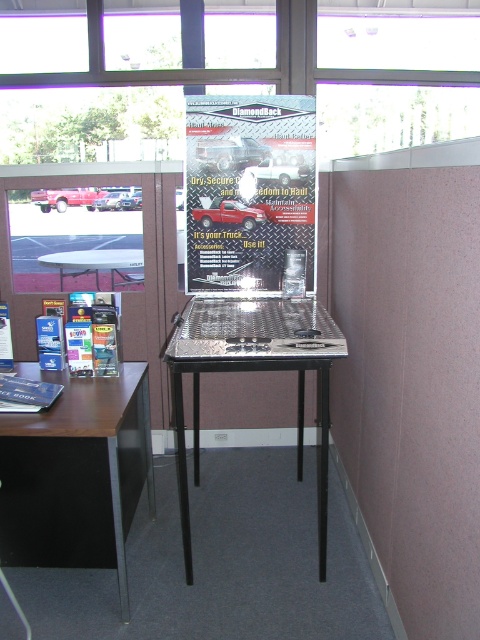
Question: Can you confirm if metallic/diamond plate table at center is positioned above transparent glass window at upper center?

Choices:
 (A) yes
 (B) no

Answer: (B)

Question: Which point appears closest to the camera in this image?

Choices:
 (A) (407, 124)
 (B) (332, 321)
 (C) (140, 417)

Answer: (B)

Question: Among these objects, which one is farthest from the camera?

Choices:
 (A) brown wood desk at lower left
 (B) transparent glass window at upper center

Answer: (B)

Question: Is diamond plate poster at center closer to the viewer compared to metallic/diamond plate table at center?

Choices:
 (A) no
 (B) yes

Answer: (A)

Question: Does matte black table at left have a greater width compared to transparent glass table at center?

Choices:
 (A) no
 (B) yes

Answer: (B)

Question: Estimate the real-world distances between objects in this image. Which object is farther from the metallic/diamond plate table at center?

Choices:
 (A) transparent glass window at upper center
 (B) matte black table at left
 (C) transparent glass table at center

Answer: (A)